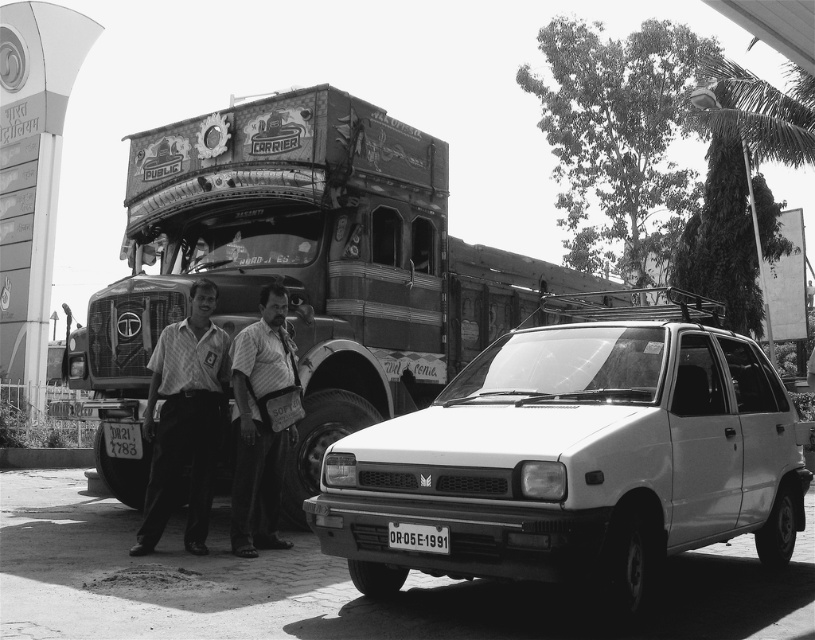
You are standing at the point marked by the coordinates [576,456] in the image. What object are you currently standing on?

The point marked by the coordinates [576,456] is on the white matte hatchback at center.

You are standing at the point marked by the coordinates (184, 419) in the image. What object is exactly at that point?

The light brown shirt at center is located at point (184, 419).

You are standing at the point marked by coordinates point (470, 499). You want to take a photo of the entire scene. Is the camera, which is 4.50 meters away from you, positioned far enough to capture the entire scene?

The camera is exactly 4.50 meters away from the point (470, 499), which is the position where you are standing. Since the camera is positioned at this distance, it should be able to capture the entire scene as described.